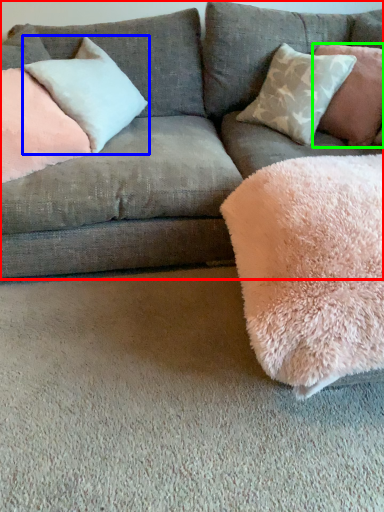
Question: Based on their relative distances, which object is nearer to studio couch (highlighted by a red box)? Choose from pillow (highlighted by a blue box) and pillow (highlighted by a green box).

Choices:
 (A) pillow
 (B) pillow

Answer: (A)